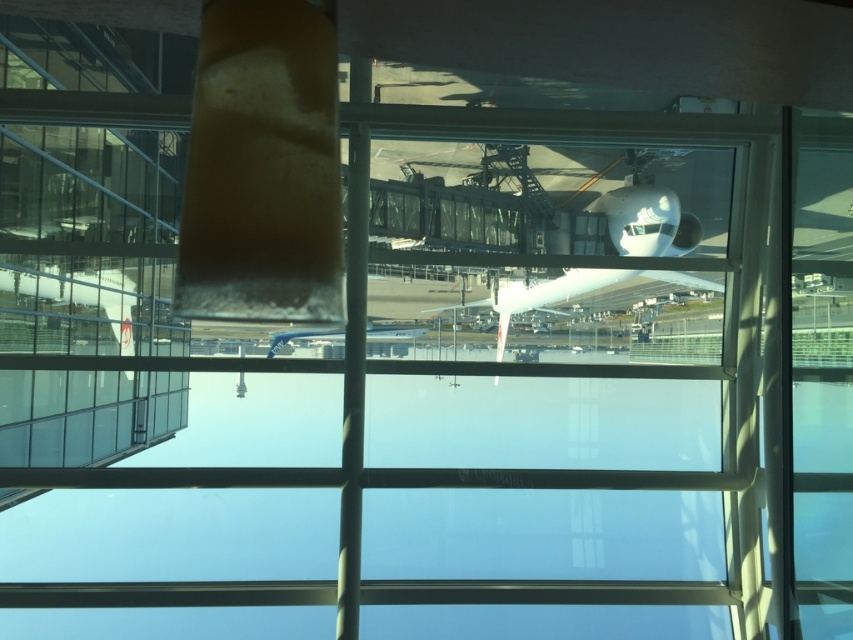
Is white glossy airplane at center wider than blue metallic airplane at center?

Yes, white glossy airplane at center is wider than blue metallic airplane at center.

Is white glossy airplane at center further to the viewer compared to blue metallic airplane at center?

Yes, white glossy airplane at center is behind blue metallic airplane at center.

The width and height of the screenshot is (853, 640). What are the coordinates of `white glossy airplane at center` in the screenshot? It's located at (645, 214).

Locate an element on the screen. The width and height of the screenshot is (853, 640). white glossy airplane at center is located at coordinates (645, 214).